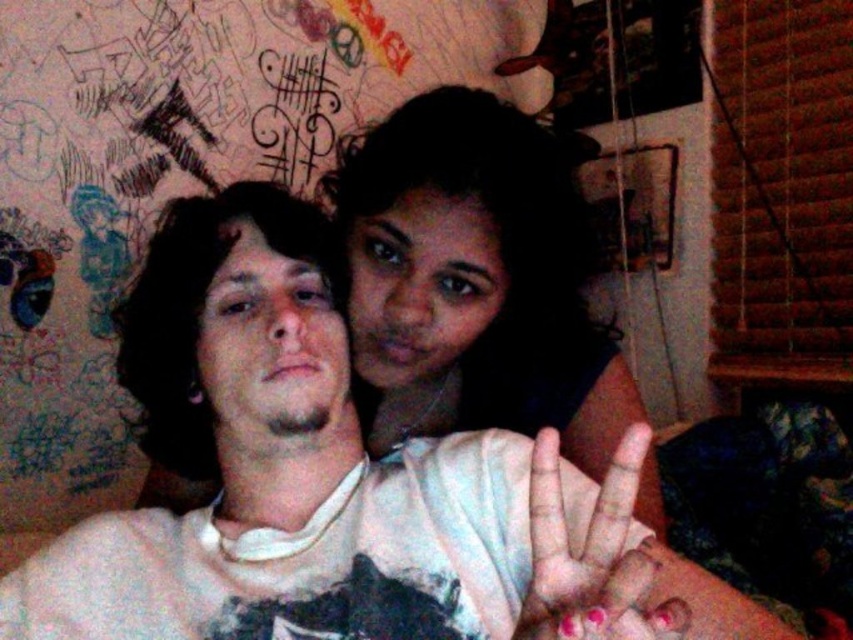
Consider the image. Measure the distance between white cotton shirt at center and camera.

They are 16.66 inches apart.

From the picture: Is white cotton shirt at center to the left of smooth skin face at center from the viewer's perspective?

Correct, you'll find white cotton shirt at center to the left of smooth skin face at center.

The width and height of the screenshot is (853, 640). What are the coordinates of `white cotton shirt at center` in the screenshot? It's located at (320, 477).

From the picture: Can you confirm if smooth skin face at center is shorter than pink painted nails at center?

In fact, smooth skin face at center may be taller than pink painted nails at center.

Can you confirm if smooth skin face at center is wider than pink painted nails at center?

Indeed, smooth skin face at center has a greater width compared to pink painted nails at center.

Which is in front, point (474, 387) or point (537, 632)?

Point (537, 632)

This screenshot has height=640, width=853. Identify the location of smooth skin face at center. (474, 280).

Is white cotton shirt at center wider than pink painted nails at center?

Indeed, white cotton shirt at center has a greater width compared to pink painted nails at center.

Which is in front, point (428, 484) or point (550, 522)?

Point (550, 522) is in front.

Which is behind, point (598, 624) or point (550, 497)?

The point (550, 497) is behind.

You are a GUI agent. You are given a task and a screenshot of the screen. Output one action in this format:
    pyautogui.click(x=<x>, y=<y>)
    Task: Click on the white cotton shirt at center
    The image size is (853, 640).
    Given the screenshot: What is the action you would take?
    pyautogui.click(x=320, y=477)